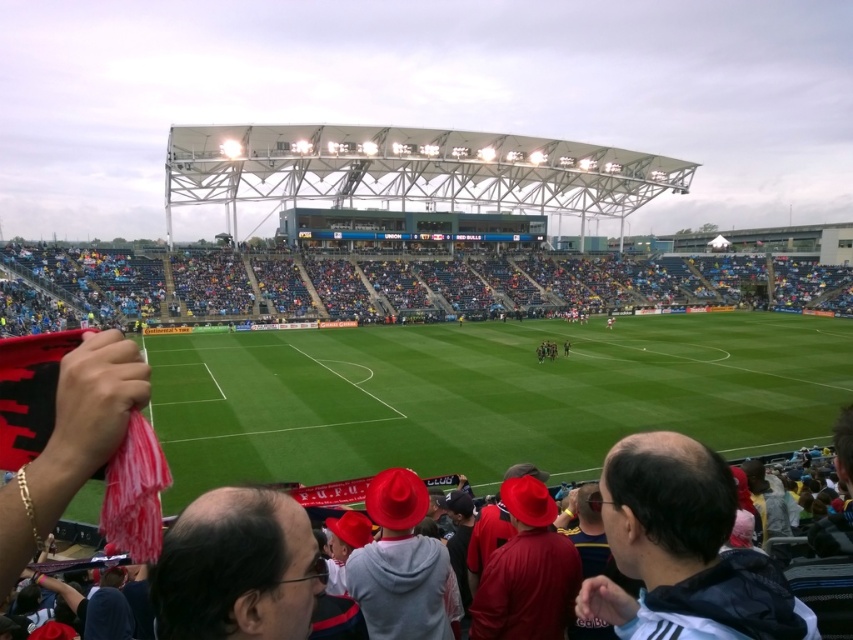
Is point (364, 312) more distant than point (692, 467)?

Yes, it is.

Which is behind, point (679, 280) or point (637, 566)?

Positioned behind is point (679, 280).

You are a GUI agent. You are given a task and a screenshot of the screen. Output one action in this format:
    pyautogui.click(x=<x>, y=<y>)
    Task: Click on the red fabric at lower left
    This screenshot has width=853, height=640.
    Given the screenshot: What is the action you would take?
    pyautogui.click(x=402, y=285)